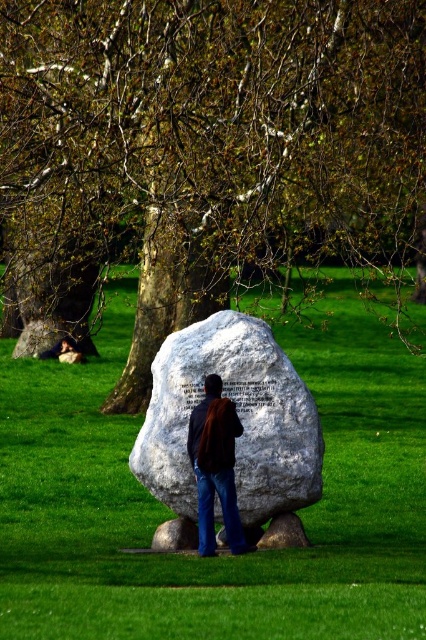
You are standing in the park and want to take a photo of the green leafy tree at center and the brown leather jacket at center. Which object should you point your camera upwards to capture?

You should point your camera upwards to capture the green leafy tree at center because it is located above the brown leather jacket at center.

You are a photographer trying to capture the smooth brown hair at lower left and the green leafy tree at center in a single shot. Which object will appear taller in the final photo?

The green leafy tree at center will appear taller in the photo because it has a greater height compared to the smooth brown hair at lower left.